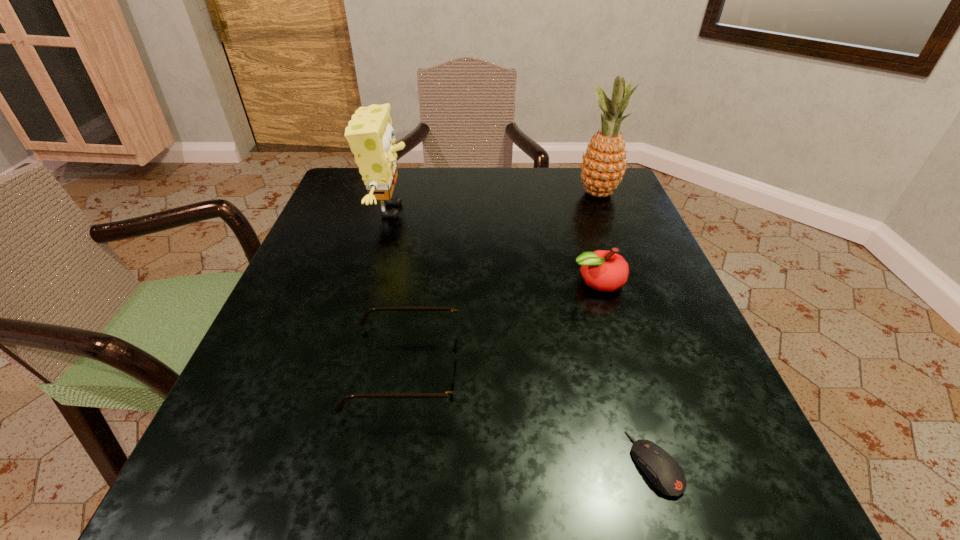
I want to click on computer mouse that is at the right edge, so click(662, 470).

At what (x,y) coordinates should I click in order to perform the action: click on object at the far left corner. Please return your answer as a coordinate pair (x, y). Looking at the image, I should click on (370, 135).

The height and width of the screenshot is (540, 960). What are the coordinates of `object located at the far right corner` in the screenshot? It's located at (604, 164).

You are a GUI agent. You are given a task and a screenshot of the screen. Output one action in this format:
    pyautogui.click(x=<x>, y=<y>)
    Task: Click on the object present at the near right corner
    The width and height of the screenshot is (960, 540).
    Given the screenshot: What is the action you would take?
    pyautogui.click(x=662, y=470)

Locate an element on the screen. vacant space at the far edge of the desktop is located at coordinates point(483,206).

Identify the location of free space at the near edge. The image size is (960, 540). (560, 514).

I want to click on vacant position at the left edge of the desktop, so click(x=242, y=397).

Locate an element on the screen. The height and width of the screenshot is (540, 960). vacant space at the right edge is located at coordinates (590, 222).

Image resolution: width=960 pixels, height=540 pixels. In order to click on free space at the far left corner of the desktop in this screenshot , I will do `click(353, 184)`.

Where is `vacant space at the near left corner of the desktop`? vacant space at the near left corner of the desktop is located at coordinates (255, 502).